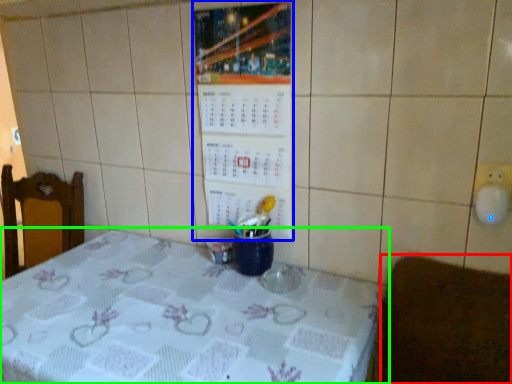
Question: Which object is positioned farthest from furniture (highlighted by a red box)? Select from bulletin board (highlighted by a blue box) and table (highlighted by a green box).

Choices:
 (A) bulletin board
 (B) table

Answer: (A)